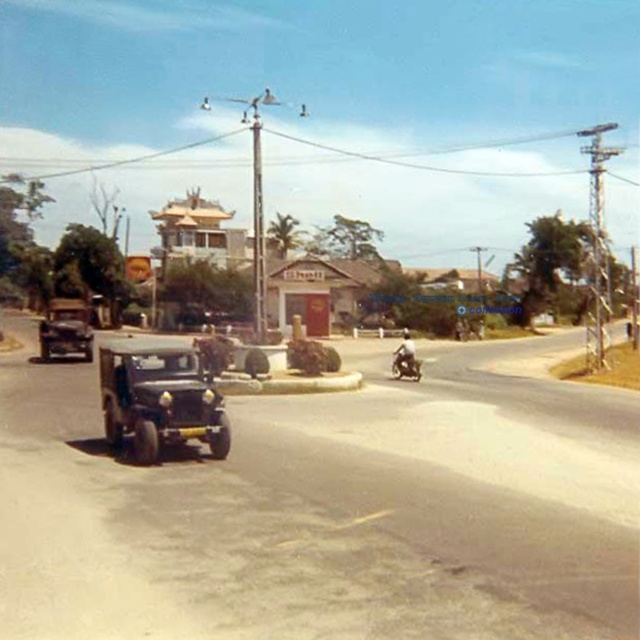
You are a photographer standing at the edge of the road. You want to take a photo that includes both the wooden temple at center and the shiny black motorcycle at center. Based on their positions, which object will appear closer to the camera in the photo?

The wooden temple at center is in front of the shiny black motorcycle at center, so it will appear closer to the camera in the photo.

You are a drone operator who needs to fly a drone over the wooden temple at center and the metallic silver motorcycle at center. Based on the scene, which object should you avoid flying too close to due to its height?

The wooden temple at center has a greater height compared to the metallic silver motorcycle at center, so you should avoid flying too close to the wooden temple at center due to its height.